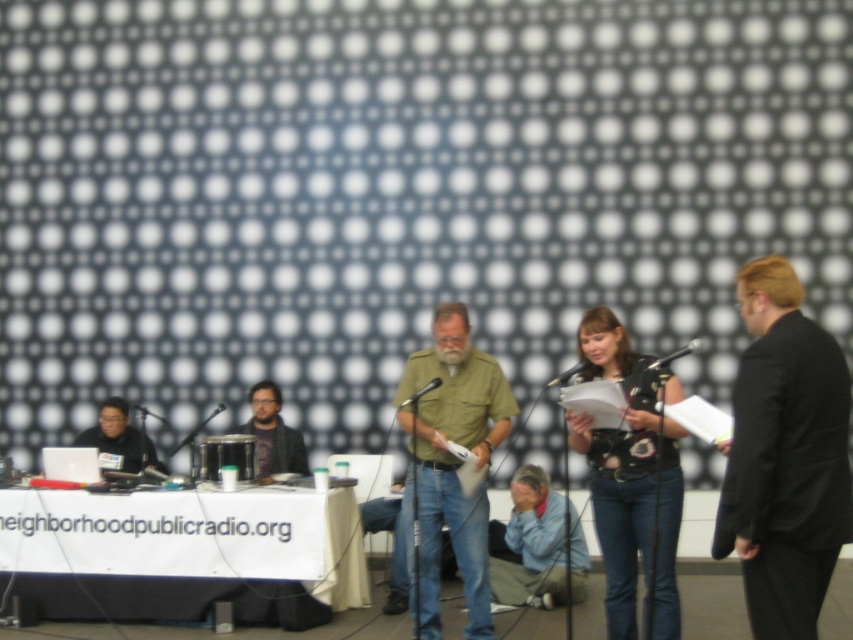
Question: Which point is closer to the camera taking this photo?

Choices:
 (A) (163, 420)
 (B) (12, 515)
 (C) (407, 397)
 (D) (461, 444)

Answer: (D)

Question: From the image, what is the correct spatial relationship of green matte shirt at center in relation to matte black microphone at center?

Choices:
 (A) above
 (B) below

Answer: (B)

Question: Which of the following is the farthest from the observer?

Choices:
 (A) black suit at right
 (B) black floral shirt at center
 (C) light blue denim jeans at lower center

Answer: (C)

Question: Among these objects, which one is farthest from the camera?

Choices:
 (A) matte black laptop at left
 (B) black plastic microphone at center

Answer: (B)

Question: Observing the image, what is the correct spatial positioning of matte black microphone at center in reference to metallic silver microphone at left?

Choices:
 (A) left
 (B) right

Answer: (B)

Question: Can you confirm if black plastic microphone at center is positioned to the right of metallic silver microphone at left?

Choices:
 (A) yes
 (B) no

Answer: (A)